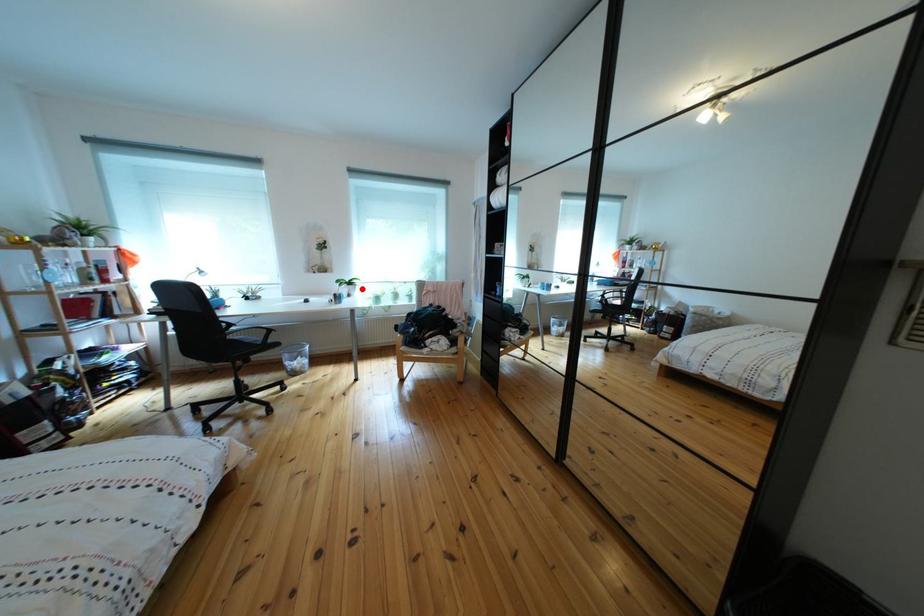
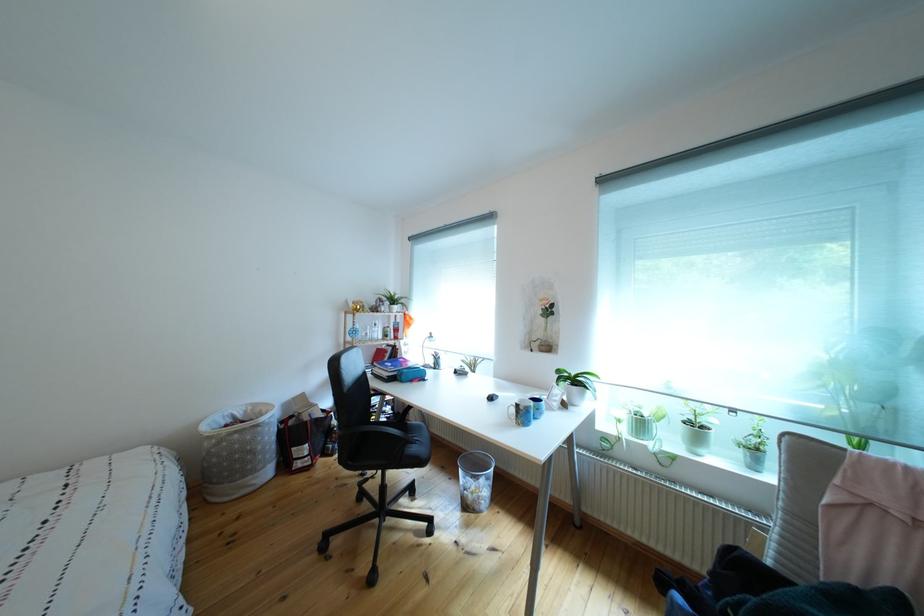
Question: A red point is marked in image1. In image2, is the corresponding 3D point closer to the camera or farther? Reply with the corresponding letter.

Choices:
 (A) The corresponding 3D point is closer.
 (B) The corresponding 3D point is farther.

Answer: (B)